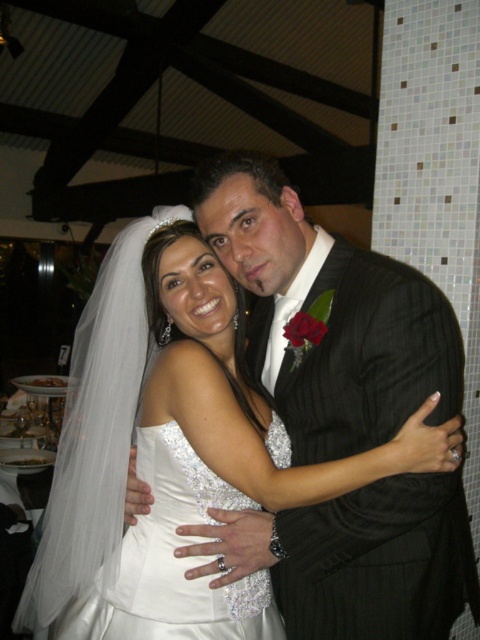
You are a photographer at the wedding reception and want to capture a photo of the matte black suit at center and the white satin dress at center. Since both are in the center, how can you position yourself to ensure both are clearly visible in the frame?

The matte black suit at center is in front of the white satin dress at center, so positioning yourself slightly to the side of the front allows you to see both the front of the suit and the dress behind it.

Based on the scene described, where is the matte black suit at center in relation to the white satin dress at center?

The matte black suit at center is to the right of the white satin dress at center.